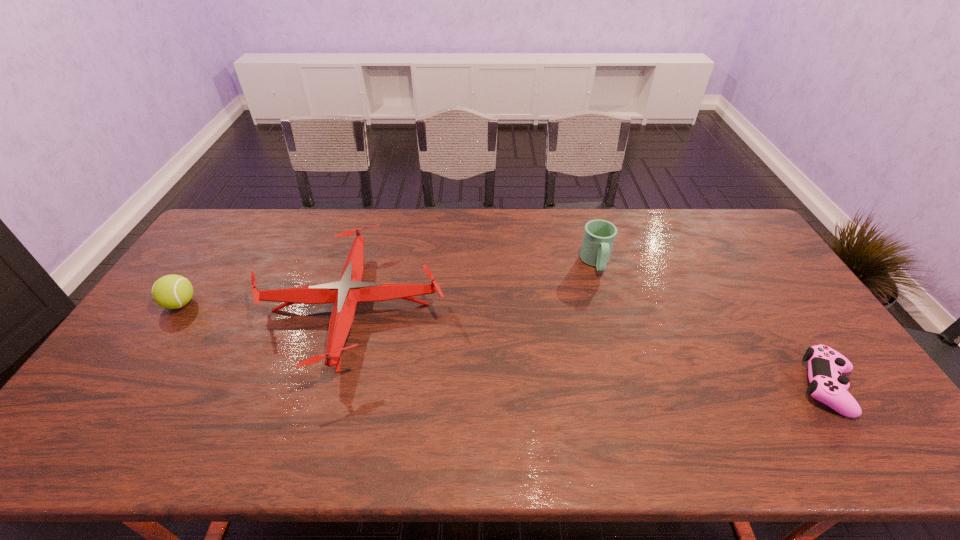
Where is `mug that is at the far edge`? This screenshot has width=960, height=540. mug that is at the far edge is located at coordinates (599, 235).

The width and height of the screenshot is (960, 540). In order to click on drone located in the far edge section of the desktop in this screenshot , I will do `click(345, 294)`.

At what (x,y) coordinates should I click in order to perform the action: click on object present at the left edge. Please return your answer as a coordinate pair (x, y). This screenshot has height=540, width=960. Looking at the image, I should click on (172, 291).

You are a GUI agent. You are given a task and a screenshot of the screen. Output one action in this format:
    pyautogui.click(x=<x>, y=<y>)
    Task: Click on the object that is at the right edge
    
    Given the screenshot: What is the action you would take?
    pyautogui.click(x=825, y=365)

Where is `vacant space at the far edge of the desktop`? vacant space at the far edge of the desktop is located at coordinates (478, 216).

You are a GUI agent. You are given a task and a screenshot of the screen. Output one action in this format:
    pyautogui.click(x=<x>, y=<y>)
    Task: Click on the free region at the near edge
    Image resolution: width=960 pixels, height=540 pixels.
    Given the screenshot: What is the action you would take?
    pyautogui.click(x=682, y=444)

In the image, there is a desktop. Where is `free space at the left edge`? free space at the left edge is located at coordinates (208, 278).

In the image, there is a desktop. Where is `vacant space at the far left corner`? The width and height of the screenshot is (960, 540). vacant space at the far left corner is located at coordinates (243, 232).

Where is `vacant space at the far right corner`? This screenshot has width=960, height=540. vacant space at the far right corner is located at coordinates (736, 234).

You are a GUI agent. You are given a task and a screenshot of the screen. Output one action in this format:
    pyautogui.click(x=<x>, y=<y>)
    Task: Click on the unoccupied position between the second object from right to left and the drone
    Image resolution: width=960 pixels, height=540 pixels.
    Given the screenshot: What is the action you would take?
    pyautogui.click(x=473, y=285)